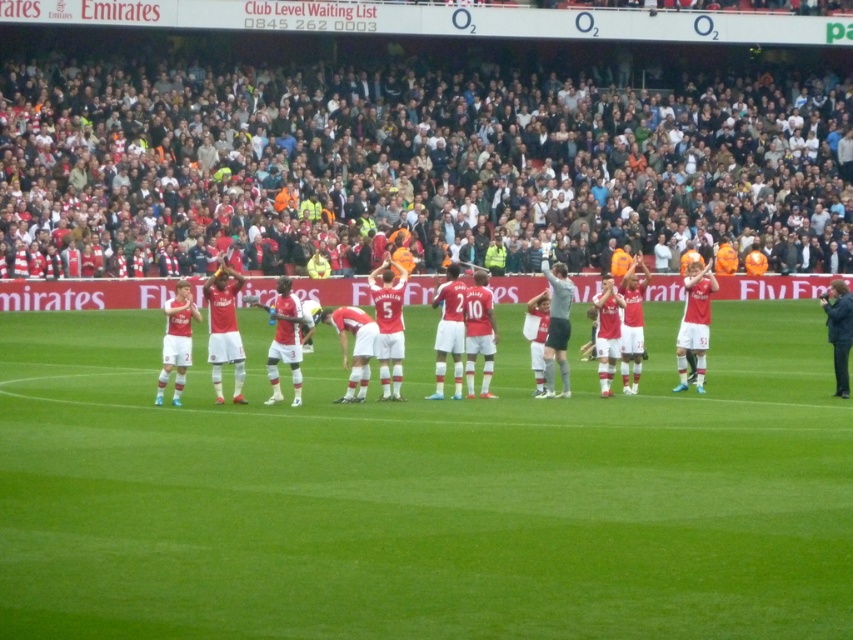
From the picture: Who is positioned more to the right, green grass football field at center or matte red jersey at center?

green grass football field at center

Does point (10, 563) come behind point (344, 282)?

No, (10, 563) is closer to viewer.

Does point (239, 556) come in front of point (538, 280)?

Yes, point (239, 556) is closer to viewer.

I want to click on green grass football field at center, so click(x=424, y=493).

In the scene shown: Does green grass football field at center appear on the left side of dark gray crowd at upper center?

Indeed, green grass football field at center is positioned on the left side of dark gray crowd at upper center.

The image size is (853, 640). What do you see at coordinates (424, 493) in the screenshot? I see `green grass football field at center` at bounding box center [424, 493].

Locate an element on the screen. The width and height of the screenshot is (853, 640). green grass football field at center is located at coordinates click(424, 493).

Is dark gray crowd at upper center further to the viewer compared to matte red jersey at center?

Yes.

Is the position of dark gray crowd at upper center less distant than that of matte red jersey at center?

No, it is not.

Is point (331, 182) positioned behind point (244, 289)?

Yes, point (331, 182) is behind point (244, 289).

What are the coordinates of `dark gray crowd at upper center` in the screenshot? It's located at (408, 168).